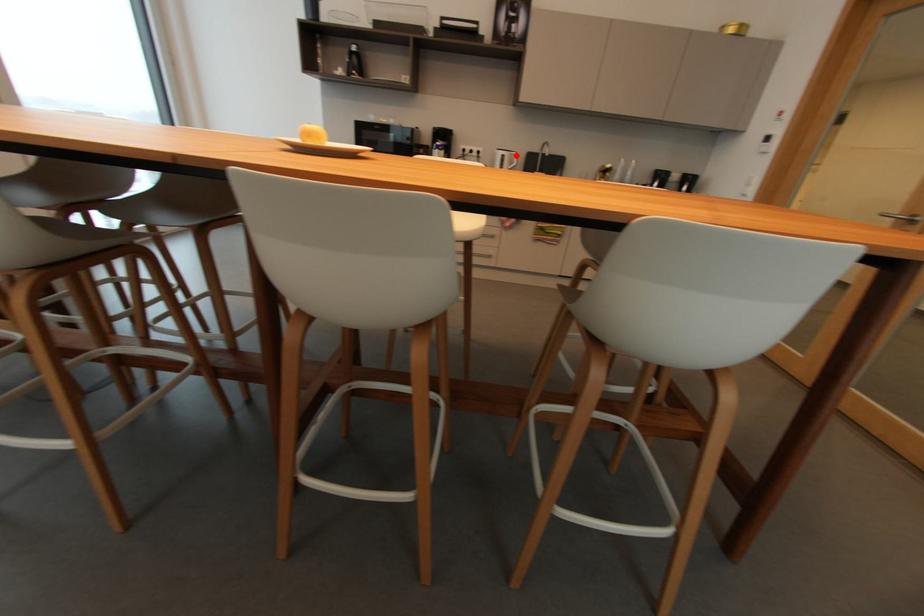
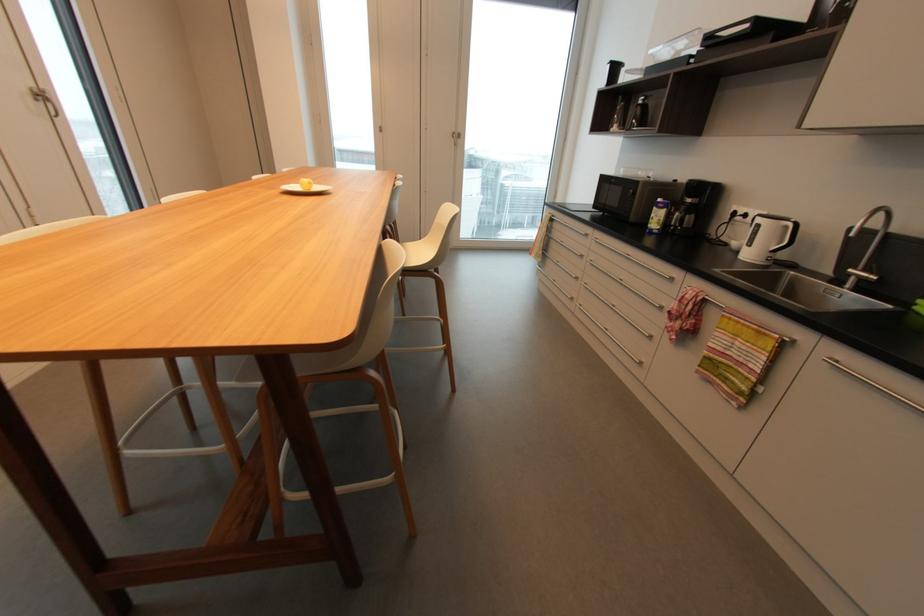
Question: I am providing you with two images of the same scene from different viewpoints. Given a red point in image1, look at the same physical point in image2. Is it:

Choices:
 (A) Closer to the viewpoint
 (B) Farther from the viewpoint

Answer: (B)